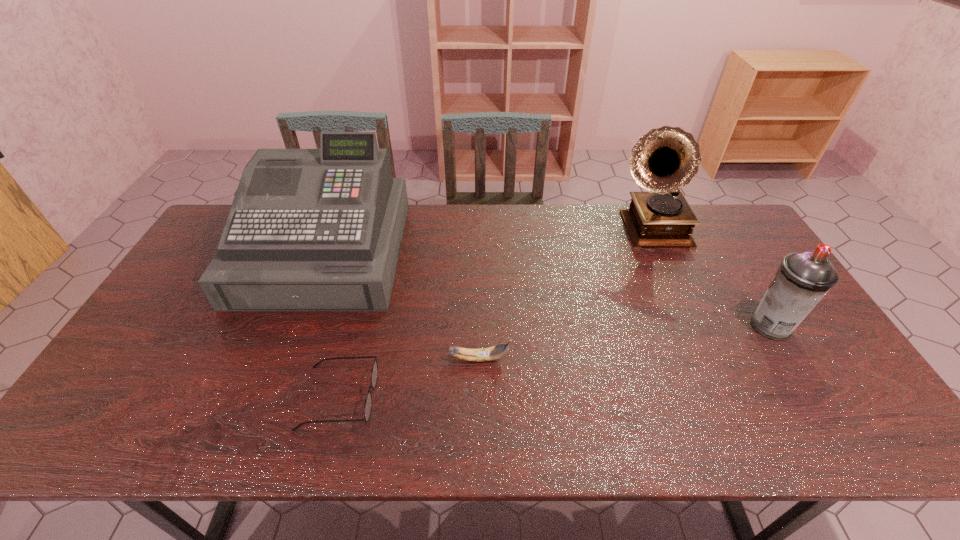
The width and height of the screenshot is (960, 540). Identify the location of free space at the left edge of the desktop. (135, 366).

The height and width of the screenshot is (540, 960). I want to click on free space at the right edge of the desktop, so click(x=729, y=275).

Where is `vacant space at the far right corner`? The height and width of the screenshot is (540, 960). vacant space at the far right corner is located at coordinates pos(735,215).

What are the coordinates of `free space between the nearest object and the fourth tallest object` in the screenshot? It's located at (409, 378).

This screenshot has height=540, width=960. Identify the location of free spot between the second object from right to left and the nearest object. (495, 315).

You are a GUI agent. You are given a task and a screenshot of the screen. Output one action in this format:
    pyautogui.click(x=<x>, y=<y>)
    Task: Click on the empty space that is in between the rightmost object and the cash register
    
    Given the screenshot: What is the action you would take?
    pyautogui.click(x=548, y=289)

The height and width of the screenshot is (540, 960). What are the coordinates of `empty location between the rightmost object and the record player` in the screenshot? It's located at (711, 279).

This screenshot has width=960, height=540. Identify the location of free space between the cash register and the nearest object. (332, 325).

Identify the location of empty location between the cash register and the record player. (488, 242).

Where is `vacant point located between the aerosol can and the nearest object`? vacant point located between the aerosol can and the nearest object is located at coordinates 555,362.